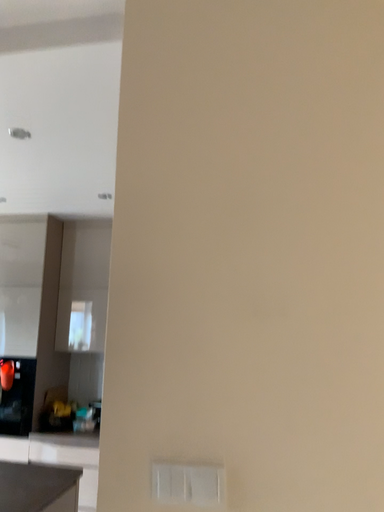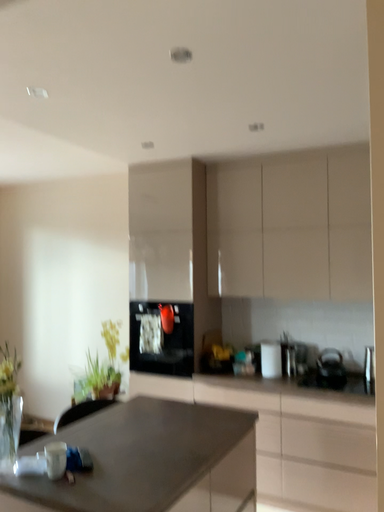
Question: How did the camera likely rotate when shooting the video?

Choices:
 (A) rotated upward
 (B) rotated downward

Answer: (B)